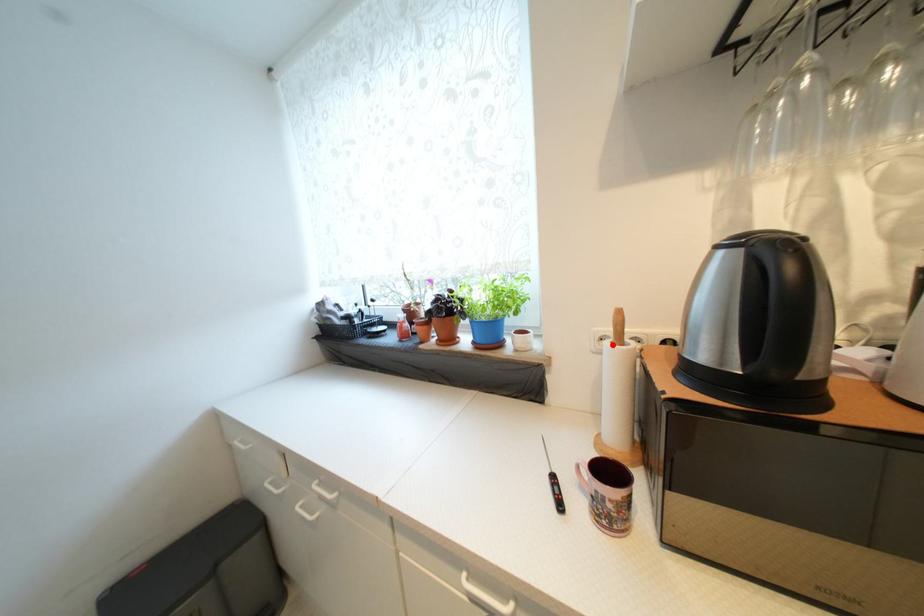
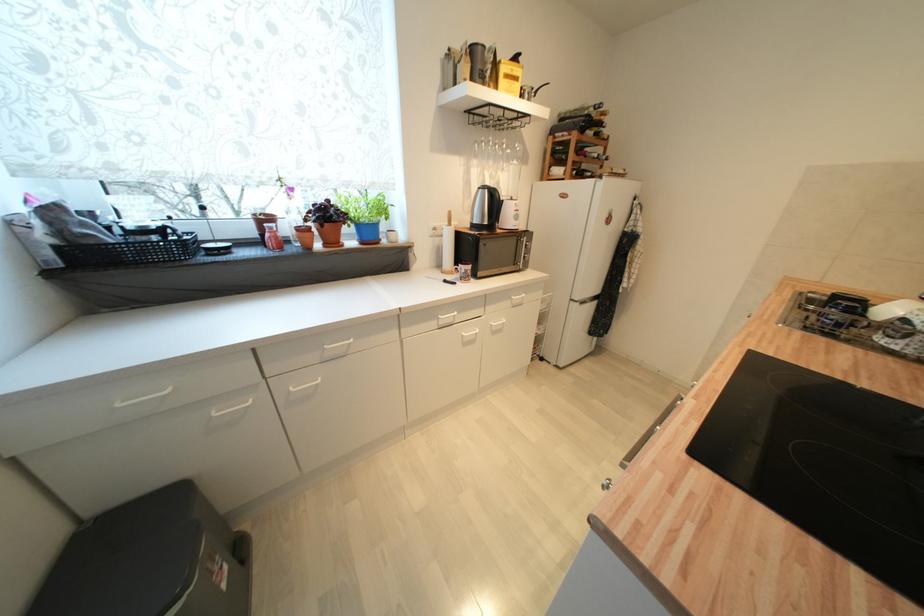
Question: I am providing you with two images of the same scene from different viewpoints. Image1 has a red point marked. In image2, the corresponding 3D location appears at what relative position? Reply with the corresponding letter.

Choices:
 (A) Closer
 (B) Farther

Answer: (A)